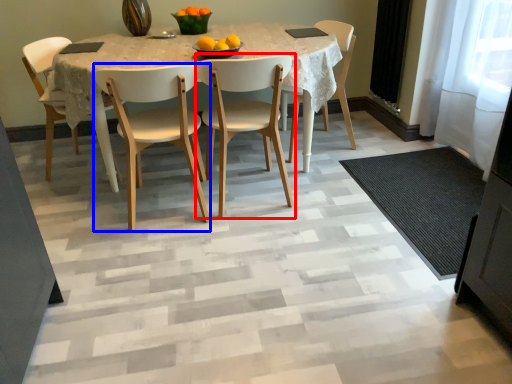
Question: Which object is further to the camera taking this photo, chair (highlighted by a red box) or chair (highlighted by a blue box)?

Choices:
 (A) chair
 (B) chair

Answer: (A)